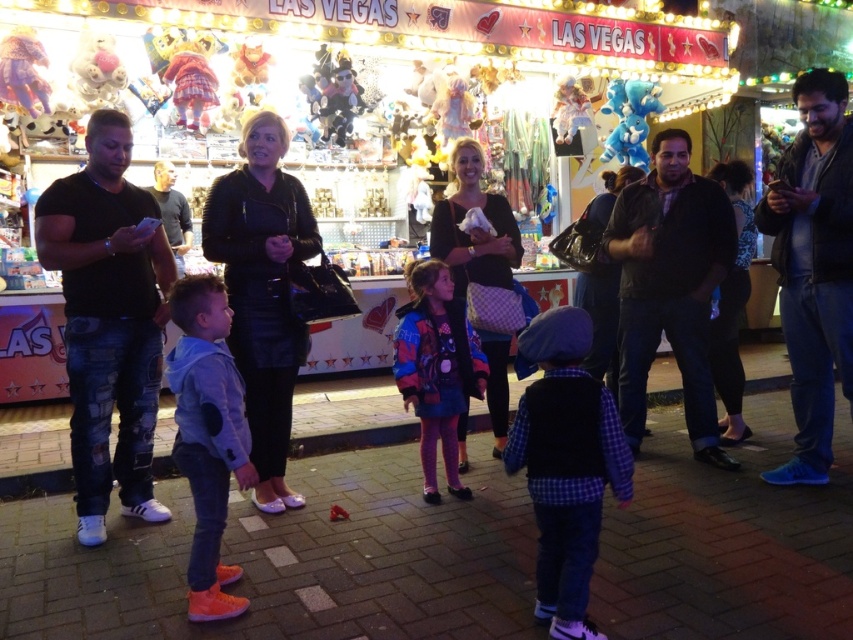
Is light blue denim jacket at center bigger than multicolored fabric jacket at center?

No.

Where is `light blue denim jacket at center`? light blue denim jacket at center is located at coordinates (207, 435).

Can you confirm if black cotton t-shirt at left is positioned to the left of plaid fabric vest at center?

Correct, you'll find black cotton t-shirt at left to the left of plaid fabric vest at center.

Does black cotton t-shirt at left appear on the right side of plaid fabric vest at center?

Incorrect, black cotton t-shirt at left is not on the right side of plaid fabric vest at center.

Is point (117, 272) closer to viewer compared to point (572, 348)?

No.

Find the location of `black cotton t-shirt at left`. black cotton t-shirt at left is located at coordinates (108, 321).

In the scene shown: Can you confirm if dark brown leather jacket at right is taller than multicolored fabric jacket at center?

Correct, dark brown leather jacket at right is much taller as multicolored fabric jacket at center.

Find the location of a particular element. dark brown leather jacket at right is located at coordinates (670, 285).